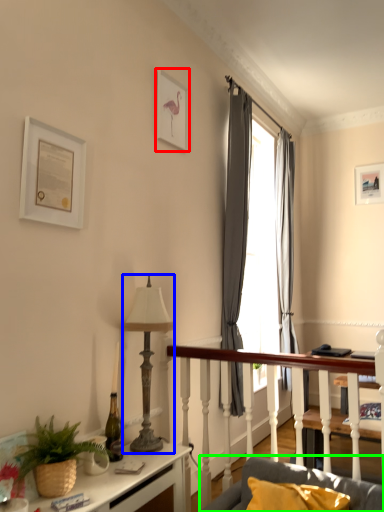
Question: Which object is positioned farthest from picture frame (highlighted by a red box)? Select from lamp (highlighted by a blue box) and studio couch (highlighted by a green box).

Choices:
 (A) lamp
 (B) studio couch

Answer: (B)